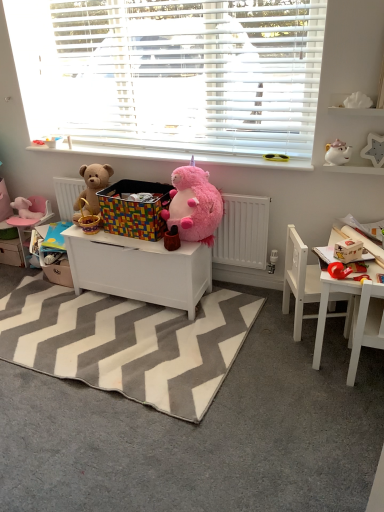
What are the coordinates of `vacant point to the left of white wooden chair at lower right, the second chair when ordered from front to back` in the screenshot? It's located at (269, 334).